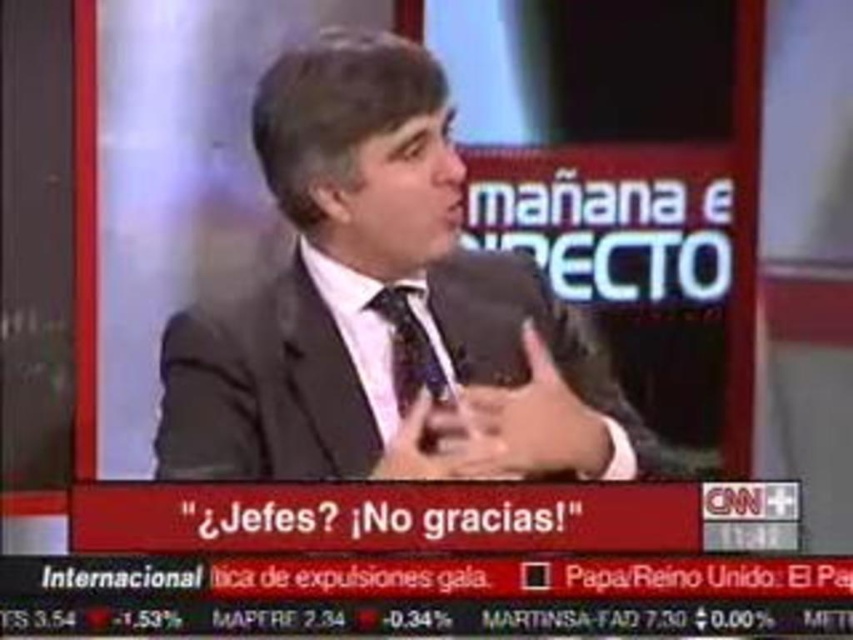
This screenshot has width=853, height=640. In order to click on matte black suit at center in this screenshot , I will do `click(386, 308)`.

Which is above, matte black suit at center or patterned silk tie at center?

patterned silk tie at center

Which is behind, point (440, 256) or point (432, 352)?

Point (432, 352)

The image size is (853, 640). In order to click on matte black suit at center in this screenshot , I will do `click(386, 308)`.